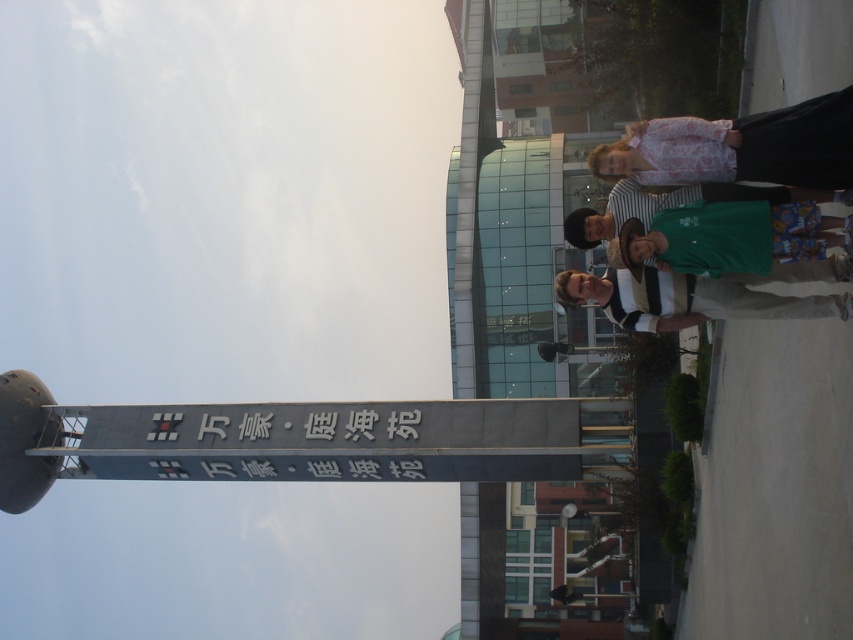
You are standing at the entrance of the Hilton Garden Inn and want to walk towards the signpost. There are two points marked on the ground in front of you. The first is at point (654, 216) and the second is at point (619, 310). Which point should you step on first if you want to walk directly toward the signpost?

Point (654, 216) is in front of point (619, 310), so you should step on point (654, 216) first when walking toward the signpost.

You are standing in front of the signpost at the Hilton Garden Inn. You see a pink floral shirt at upper right and a green cotton shirt at center. Which shirt is closer to you?

The pink floral shirt at upper right is closer to you because it is in front of the green cotton shirt at center.

You are standing at the entrance of the Hilton Garden Inn and want to walk towards the signpost. There are two points marked on the ground in front of you. The first point is at coordinate point(x=743, y=173) and the second point is at point(x=578, y=243). Which point should you step on first to move closer to the signpost?

You should step on point(x=743, y=173) first because it is in front of point(x=578, y=243), meaning it is closer to the signpost.